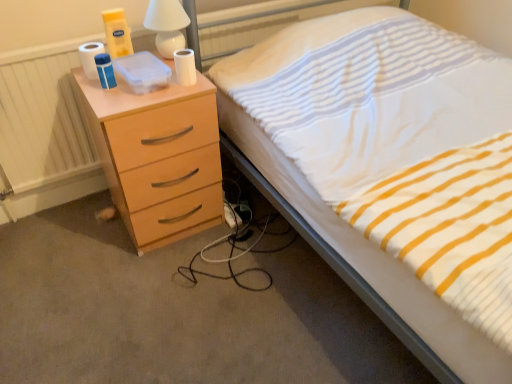
Question: Considering the relative positions of matte wood chest of drawers at left and white striped fabric at upper right in the image provided, is matte wood chest of drawers at left behind white striped fabric at upper right?

Choices:
 (A) no
 (B) yes

Answer: (B)

Question: From the image's perspective, does matte wood chest of drawers at left appear higher than white striped fabric at upper right?

Choices:
 (A) yes
 (B) no

Answer: (B)

Question: Is matte wood chest of drawers at left smaller than white striped fabric at upper right?

Choices:
 (A) yes
 (B) no

Answer: (A)

Question: Is matte wood chest of drawers at left at the right side of white striped fabric at upper right?

Choices:
 (A) no
 (B) yes

Answer: (A)

Question: From the image's perspective, is matte wood chest of drawers at left beneath white striped fabric at upper right?

Choices:
 (A) no
 (B) yes

Answer: (B)

Question: Can you confirm if matte wood chest of drawers at left is taller than white striped fabric at upper right?

Choices:
 (A) yes
 (B) no

Answer: (B)

Question: Considering the relative sizes of white fabric extension cord at lower center and white striped fabric at upper right in the image provided, is white fabric extension cord at lower center thinner than white striped fabric at upper right?

Choices:
 (A) yes
 (B) no

Answer: (A)

Question: Is white fabric extension cord at lower center looking in the opposite direction of white striped fabric at upper right?

Choices:
 (A) yes
 (B) no

Answer: (B)

Question: Does white fabric extension cord at lower center have a greater height compared to white striped fabric at upper right?

Choices:
 (A) yes
 (B) no

Answer: (B)

Question: Is white fabric extension cord at lower center wider than white striped fabric at upper right?

Choices:
 (A) yes
 (B) no

Answer: (B)

Question: Is white fabric extension cord at lower center aimed at white striped fabric at upper right?

Choices:
 (A) no
 (B) yes

Answer: (A)

Question: Does white fabric extension cord at lower center have a larger size compared to white striped fabric at upper right?

Choices:
 (A) no
 (B) yes

Answer: (A)

Question: From a real-world perspective, is white matte toilet paper at upper left, acting as the 2th toilet paper starting from the right, on top of white matte toilet paper at upper center, the 1th toilet paper viewed from the right?

Choices:
 (A) yes
 (B) no

Answer: (A)